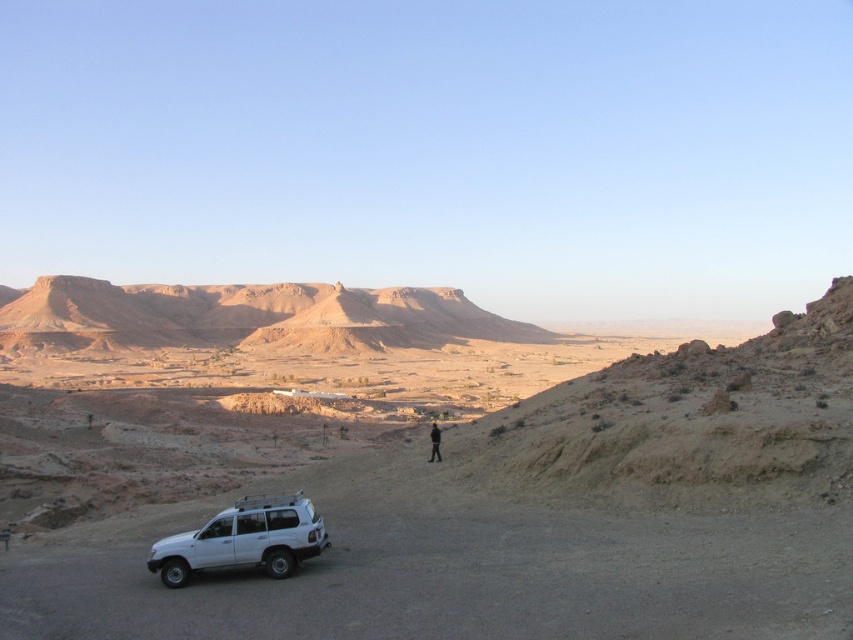
From the picture: You are a photographer planning to capture the brown rocky mountain at upper center and the black fabric person at center in a single frame. Based on their positions, can you determine which object appears higher in the image?

The brown rocky mountain at upper center appears higher in the image because it is positioned above the black fabric person at center.

You are planning a hiking trip and want to know if the brown rocky mountain at upper center is a good choice for a short hike compared to the white matte jeep at lower left. Based on their sizes, which one would you recommend for a quicker climb?

The brown rocky mountain at upper center is much taller than the white matte jeep at lower left, so the white matte jeep at lower left would be a quicker climb.